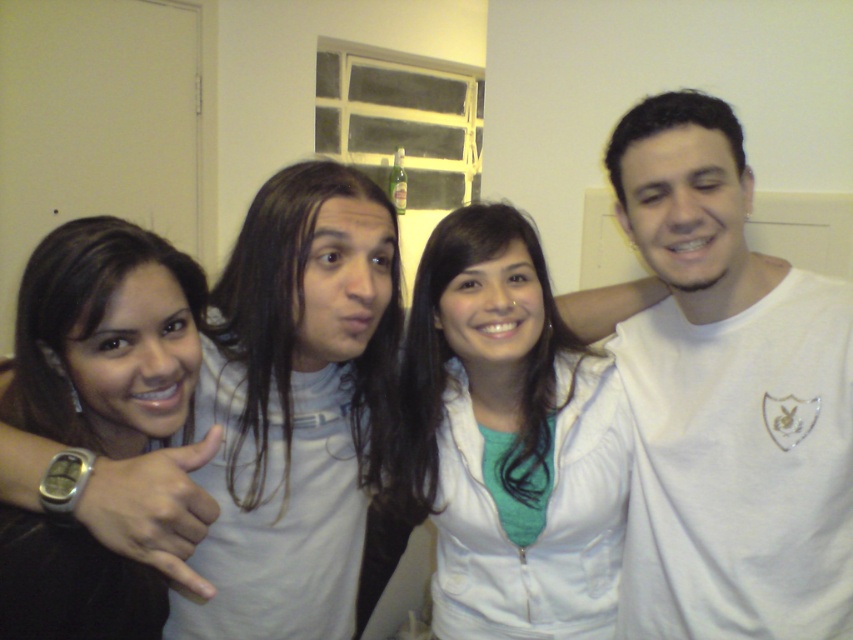
You are standing in the room and want to hand a gift to the person wearing the white matte jacket at center without moving closer than 3 feet from your current position. Is this possible?

The white matte jacket at center is 3.76 feet away from the camera, so you can hand the gift without moving closer than 3 feet since the distance is sufficient.